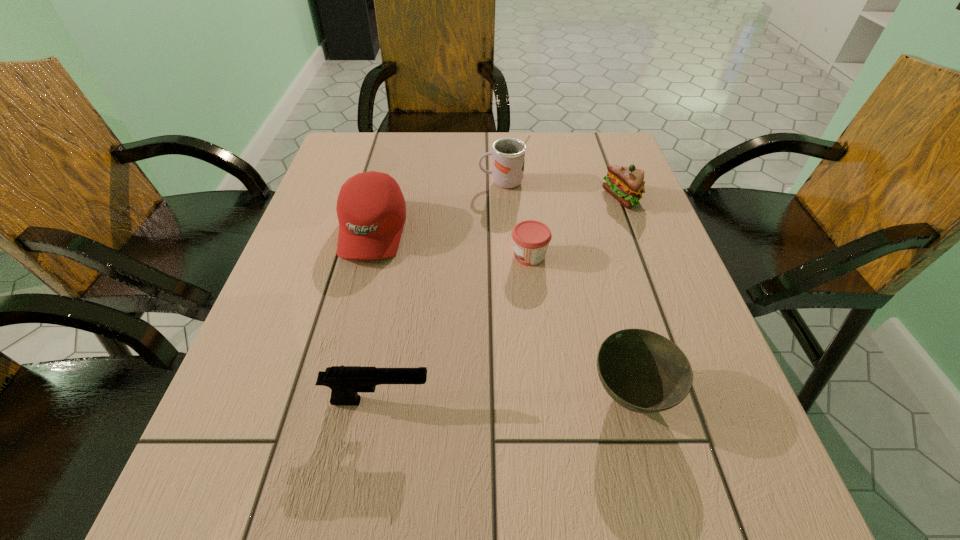
Where is `vacant space situated on the front of the sandwich`? This screenshot has width=960, height=540. vacant space situated on the front of the sandwich is located at coordinates (673, 332).

Where is `vacant area situated on the front-facing side of the pistol`? This screenshot has width=960, height=540. vacant area situated on the front-facing side of the pistol is located at coordinates (574, 401).

Identify the location of free region located on the left of the bowl. (495, 395).

I want to click on vacant space located on the front label of the jam, so click(342, 255).

You are a GUI agent. You are given a task and a screenshot of the screen. Output one action in this format:
    pyautogui.click(x=<x>, y=<y>)
    Task: Click on the vacant space located on the front label of the jam
    The image size is (960, 540).
    Given the screenshot: What is the action you would take?
    pyautogui.click(x=361, y=255)

The width and height of the screenshot is (960, 540). I want to click on vacant point located on the front label of the jam, so click(x=365, y=255).

At what (x,y) coordinates should I click in order to perform the action: click on object present at the far edge. Please return your answer as a coordinate pair (x, y). Looking at the image, I should click on (508, 162).

This screenshot has width=960, height=540. What are the coordinates of `cap at the left edge` in the screenshot? It's located at (371, 210).

Find the location of a particular element. The image size is (960, 540). pistol present at the left edge is located at coordinates (345, 382).

Locate an element on the screen. sandwich located in the right edge section of the desktop is located at coordinates (626, 184).